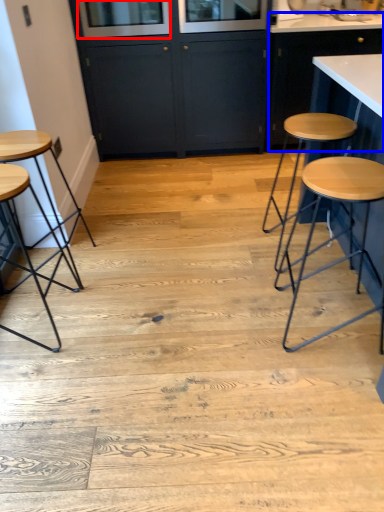
Question: Among these objects, which one is nearest to the camera, window screen (highlighted by a red box) or cabinetry (highlighted by a blue box)?

Choices:
 (A) window screen
 (B) cabinetry

Answer: (A)